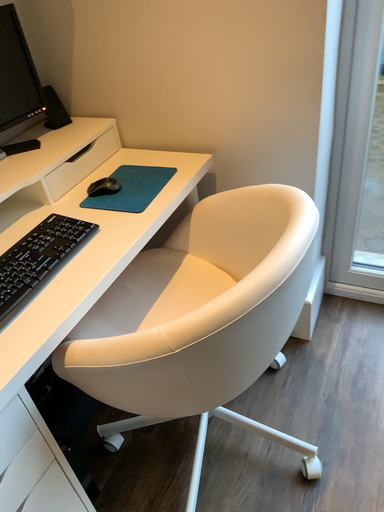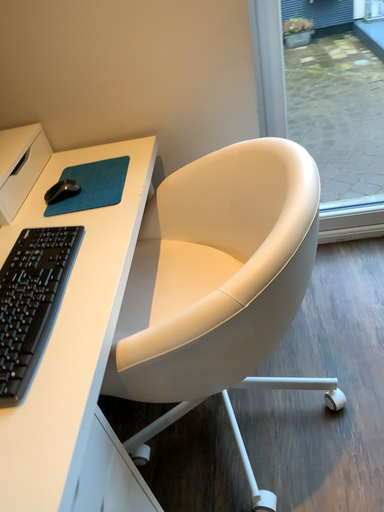
Question: Which way did the camera rotate in the video?

Choices:
 (A) rotated right
 (B) rotated left

Answer: (A)